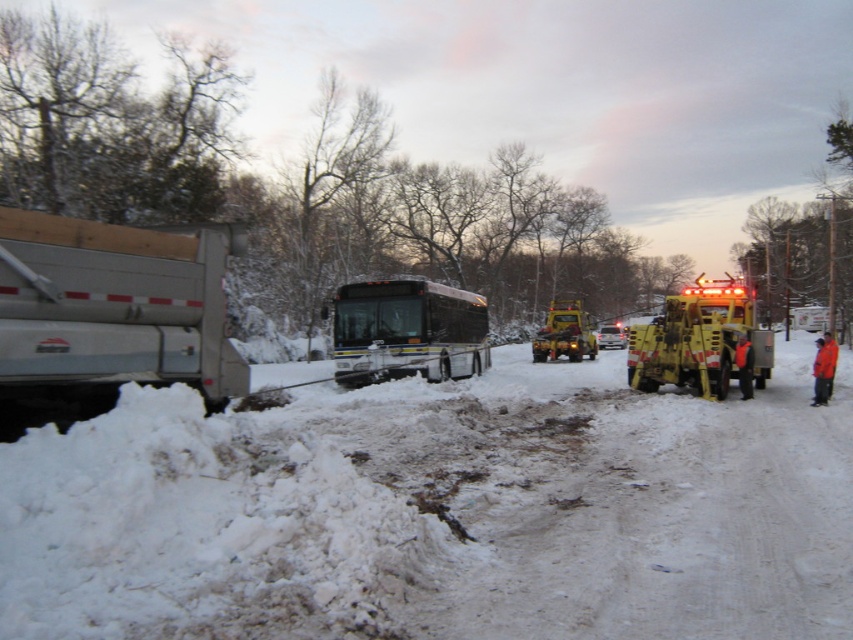
Does silver metallic dump truck at left appear on the right side of yellow rubber fire truck at center?

No, silver metallic dump truck at left is not to the right of yellow rubber fire truck at center.

Between point (138, 316) and point (556, 321), which one is positioned in front?

Point (138, 316)

Which is behind, point (18, 408) or point (577, 349)?

The point (577, 349) is more distant.

The image size is (853, 640). Identify the location of silver metallic dump truck at left. (111, 310).

Which is in front, point (717, 449) or point (569, 348)?

Point (717, 449)

Can you confirm if white powdery snow at lower left is wider than yellow rubber fire truck at center?

Indeed, white powdery snow at lower left has a greater width compared to yellow rubber fire truck at center.

The height and width of the screenshot is (640, 853). Describe the element at coordinates (434, 513) in the screenshot. I see `white powdery snow at lower left` at that location.

Where is `white powdery snow at lower left`? The width and height of the screenshot is (853, 640). white powdery snow at lower left is located at coordinates (434, 513).

Is point (91, 547) in front of point (178, 349)?

Yes, it is.

Which is behind, point (148, 460) or point (138, 253)?

Point (138, 253)

From the picture: Who is more forward, (209, 554) or (235, 378)?

Positioned in front is point (209, 554).

Find the location of a particular element. Image resolution: width=853 pixels, height=640 pixels. white powdery snow at lower left is located at coordinates (434, 513).